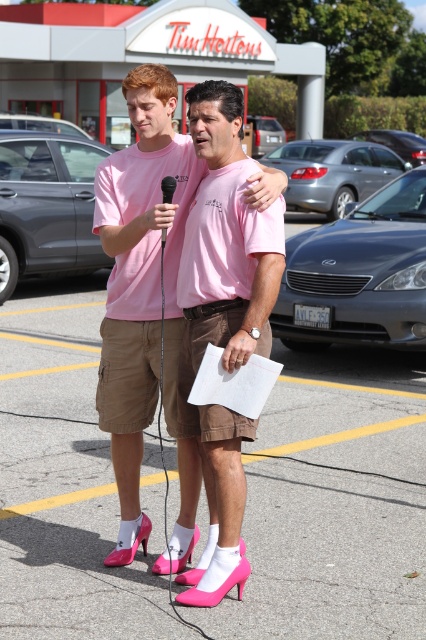
You are a photographer trying to capture a clear shot of both the pink fabric shoes at center and the black plastic microphone at center. Since you want both items to be visible in the photo, should you adjust your camera angle to look upward or downward?

The black plastic microphone at center is behind pink fabric shoes at center. To ensure both are visible, you should adjust your camera angle to look upward so the microphone isn

You are a photographer trying to capture a photo of the two people in the parking lot. You notice the pink fabric shoes at center and the black plastic microphone at center. Which object should you focus on first if you want to include both in your shot without moving the camera?

The pink fabric shoes at center is located below the black plastic microphone at center, so you should focus on the black plastic microphone at center first to ensure both objects are in frame.

You are a photographer trying to capture a photo of both individuals in the scene. You notice two specific points marked in the image. The first point is at coordinates point (118, 220) and the second at point (161, 195). Based on their positions, which point is closer to the photographer?

Point (118, 220) is in front of point (161, 195), so it is closer to the photographer.